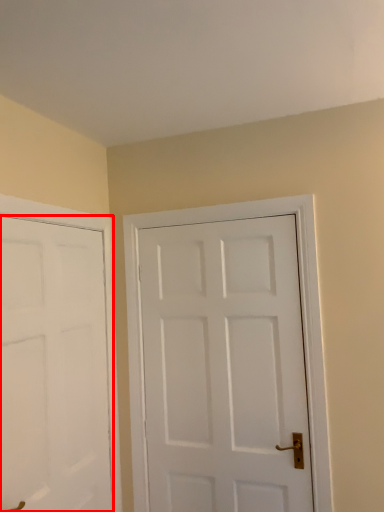
Question: From the image's perspective, what is the correct spatial positioning of door (annotated by the red box) in reference to door?

Choices:
 (A) below
 (B) above

Answer: (A)